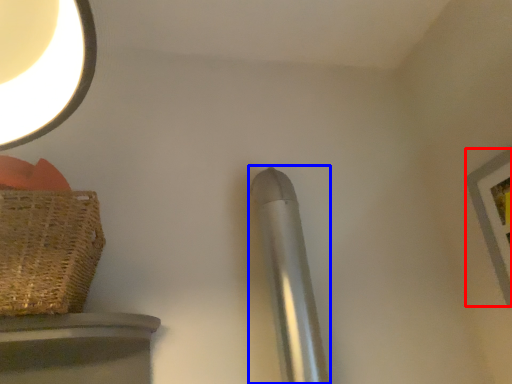
Question: Which object is further to the camera taking this photo, picture frame (highlighted by a red box) or steel (highlighted by a blue box)?

Choices:
 (A) picture frame
 (B) steel

Answer: (B)